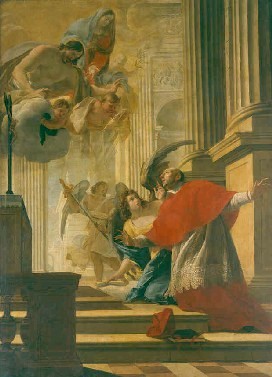
The width and height of the screenshot is (272, 377). Identify the location of pillar. (248, 95), (143, 141), (37, 176).